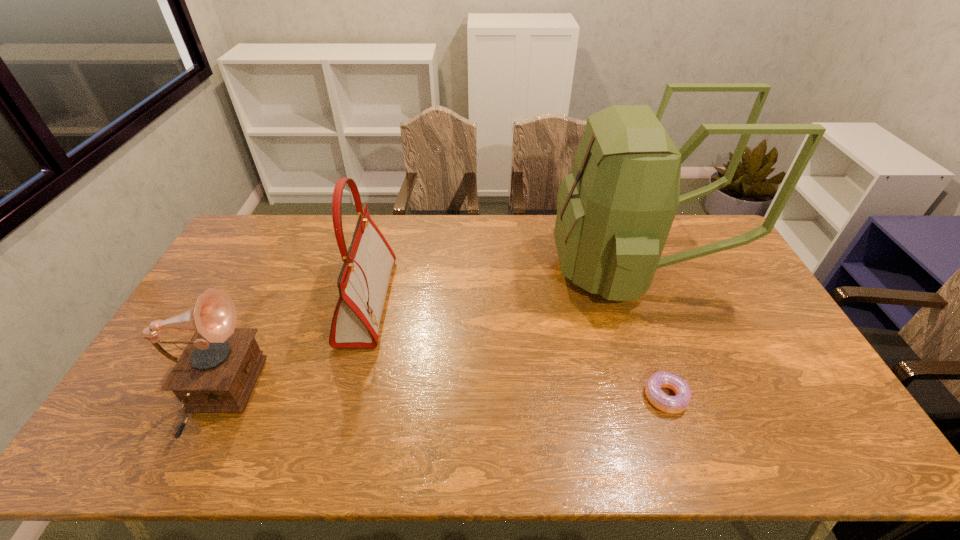
You are a GUI agent. You are given a task and a screenshot of the screen. Output one action in this format:
    pyautogui.click(x=<x>, y=<y>)
    Task: Click on the free spot between the second tallest object and the doughnut
    
    Given the screenshot: What is the action you would take?
    pyautogui.click(x=516, y=349)

Identify the location of vacant space in between the handbag and the record player. The image size is (960, 540). (290, 350).

Image resolution: width=960 pixels, height=540 pixels. Identify the location of free area in between the tallest object and the leftmost object. (423, 334).

Where is `empty location between the backpack and the leftmost object`? The image size is (960, 540). empty location between the backpack and the leftmost object is located at coordinates (423, 334).

Where is `object that is the third closest to the handbag`? This screenshot has height=540, width=960. object that is the third closest to the handbag is located at coordinates (676, 404).

Identify which object is the closest to the third shortest object. Please provide its 2D coordinates. Your answer should be formatted as a tuple, i.e. [(x, y)], where the tuple contains the x and y coordinates of a point satisfying the conditions above.

[(216, 373)]